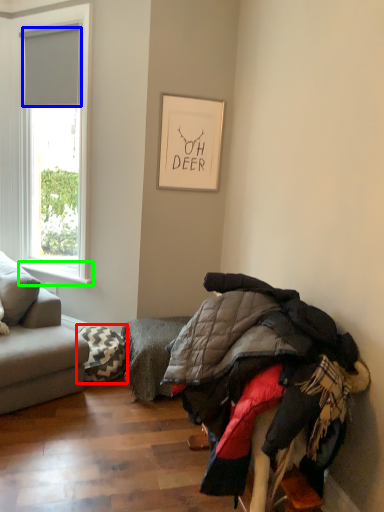
Question: Which object is the closest to the pillow (highlighted by a red box)? Choose among these: blind (highlighted by a blue box) or window sill (highlighted by a green box).

Choices:
 (A) blind
 (B) window sill

Answer: (B)